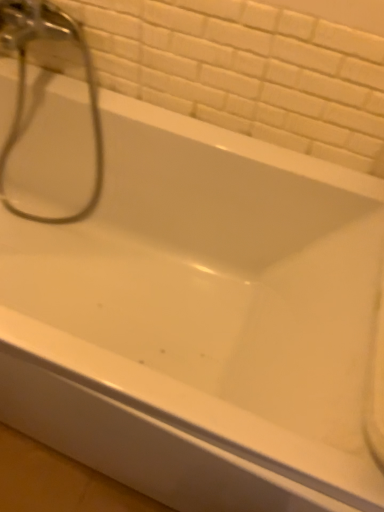
What do you see at coordinates (24, 82) in the screenshot?
I see `chrome metallic showerhead at upper left` at bounding box center [24, 82].

The height and width of the screenshot is (512, 384). Identify the location of chrome metallic showerhead at upper left. (24, 82).

Locate an element on the screen. chrome metallic showerhead at upper left is located at coordinates click(x=24, y=82).